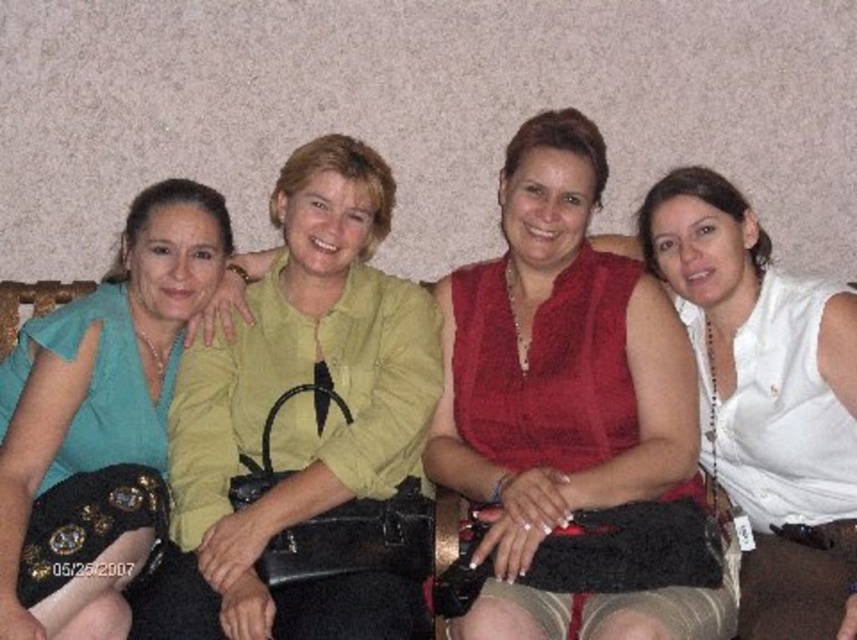
Between matte red blouse at center and teal fabric dress at left, which one is positioned lower?

teal fabric dress at left

From the picture: Can you confirm if matte red blouse at center is positioned above teal fabric dress at left?

Yes.

Is point (633, 304) less distant than point (22, 564)?

No, it is not.

In order to click on matte red blouse at center in this screenshot , I will do `click(564, 396)`.

Is point (530, 332) in front of point (376, 582)?

That is False.

Does matte red blouse at center have a lesser width compared to matte green blouse at center?

In fact, matte red blouse at center might be wider than matte green blouse at center.

Does point (608, 269) lie in front of point (225, 620)?

No, (608, 269) is further to viewer.

Where is `matte red blouse at center`? matte red blouse at center is located at coordinates (564, 396).

Is point (686, 225) behind point (81, 406)?

Yes, point (686, 225) is behind point (81, 406).

Is point (736, 333) closer to viewer compared to point (55, 412)?

No, it is not.

Identify the location of white matte tank top at center. The height and width of the screenshot is (640, 857). (766, 396).

Where is `white matte tank top at center`? The height and width of the screenshot is (640, 857). white matte tank top at center is located at coordinates (766, 396).